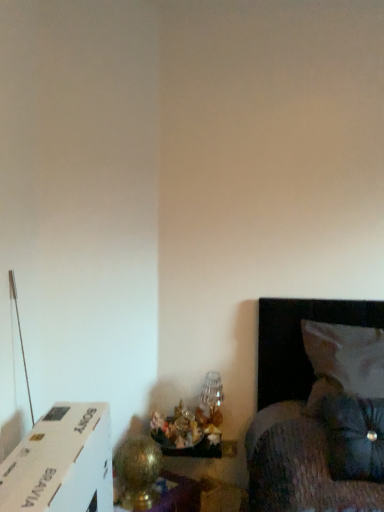
Locate an element on the screen. Image resolution: width=384 pixels, height=512 pixels. vacant space underneath gold metallic table lamp at lower left, acting as the second table lamp starting from the right (from a real-world perspective) is located at coordinates (142, 500).